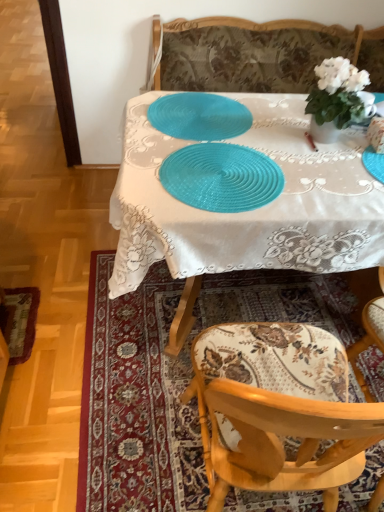
Locate an element on the screen. empty space that is ontop of wooden floral-patterned chair at lower right is located at coordinates (276, 355).